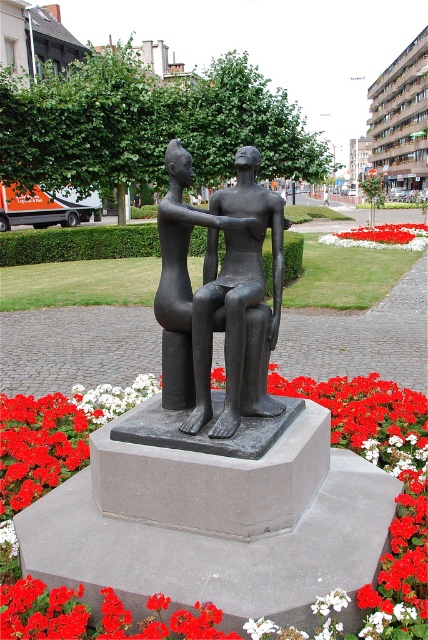
You are a gardener planning to replace the red matte flower at center and the white fabric flower at lower center with new ones. Which flower should you choose to replace the smaller one?

The red matte flower at center has a smaller size compared to the white fabric flower at lower center, so you should replace the red matte flower at center.

You are standing in front of the sculpture and want to take a photo. You notice two points on the sculpture labeled as point (x=249, y=214) and point (x=401, y=241). Which point will appear larger in your photo?

Point (x=249, y=214) is closer to the camera than point (x=401, y=241), so it will appear larger in the photo.